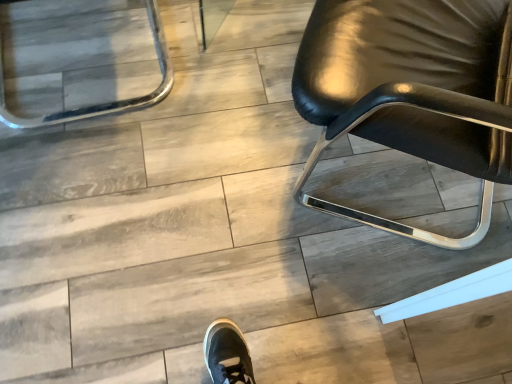
Image resolution: width=512 pixels, height=384 pixels. In order to click on vacant area in front of clear glass tray at upper left, placed as the 2th chair when sorted from right to left in this screenshot , I will do `click(94, 207)`.